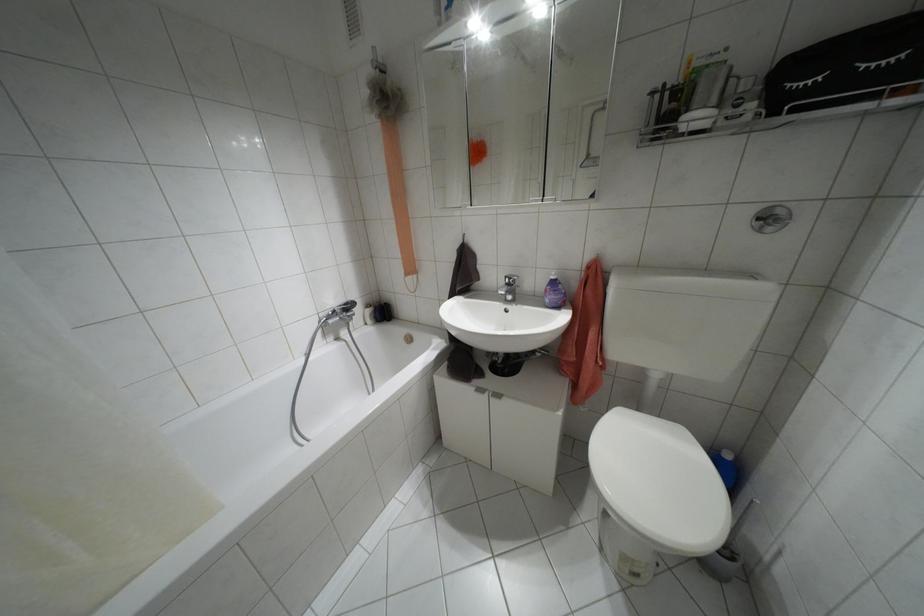
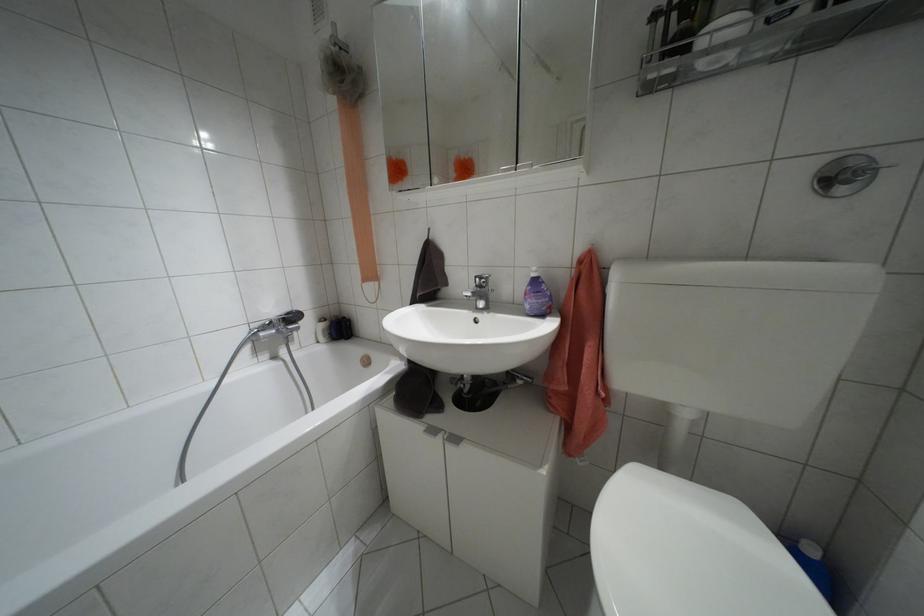
In the second image, find the point that corresponds to (x=480, y=390) in the first image.

(432, 430)